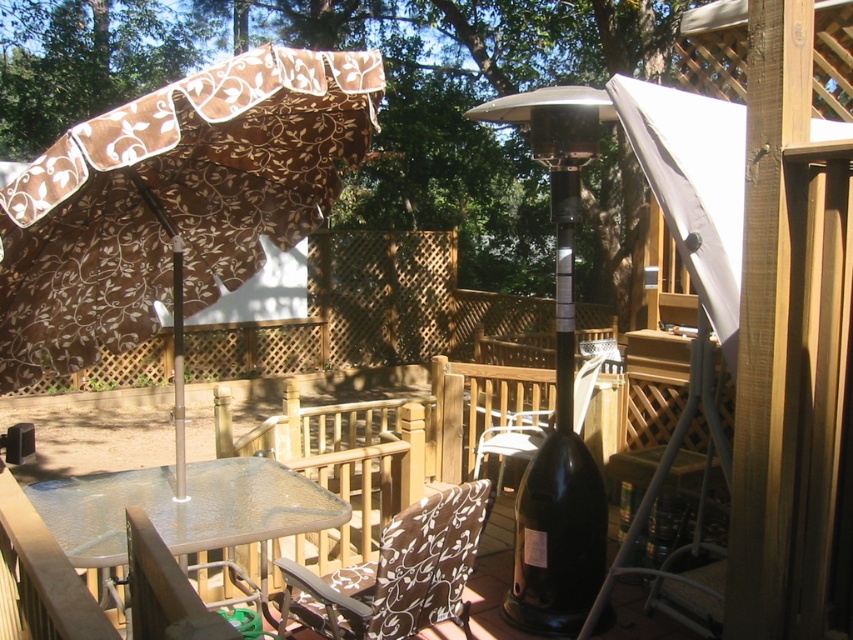
Question: Can you confirm if white fabric canopy at upper right is positioned below brown floral fabric chair at lower center?

Choices:
 (A) no
 (B) yes

Answer: (A)

Question: Can you confirm if transparent glass table at lower center is bigger than white fabric canopy at upper right?

Choices:
 (A) yes
 (B) no

Answer: (B)

Question: Which object is closer to the camera taking this photo?

Choices:
 (A) black matte wine bottle at lower center
 (B) transparent glass table at lower center
 (C) brown floral fabric chair at lower center

Answer: (B)

Question: Is black glass bottle at center to the left of brown fabric chair at lower center from the viewer's perspective?

Choices:
 (A) yes
 (B) no

Answer: (B)

Question: Estimate the real-world distances between objects in this image. Which object is closer to the brown floral fabric umbrella at upper left?

Choices:
 (A) black matte wine bottle at lower center
 (B) brown fabric chair at center

Answer: (A)

Question: Which of the following is the closest to the observer?

Choices:
 (A) black glass bottle at center
 (B) black matte wine bottle at lower center
 (C) white fabric canopy at upper right
 (D) brown fabric chair at lower center

Answer: (D)